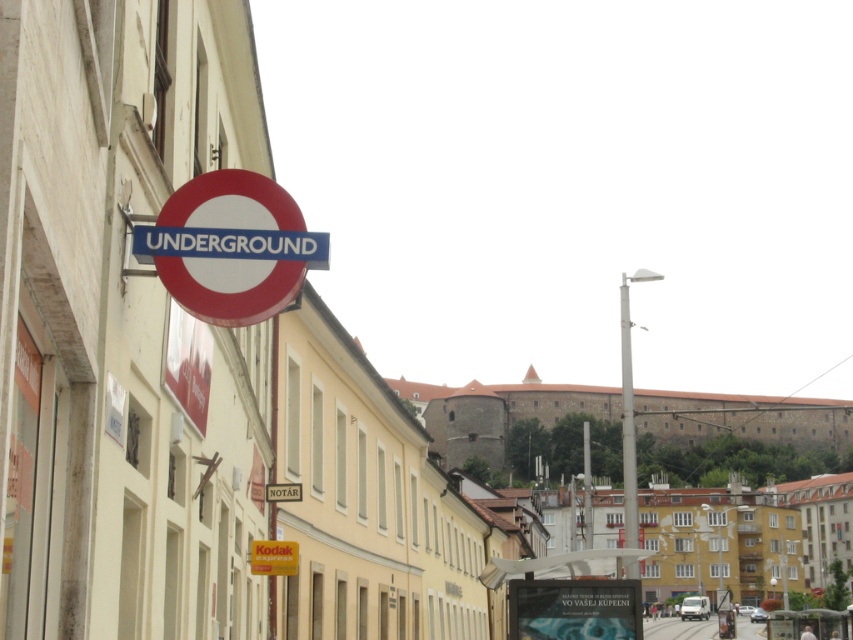
You are standing on the street looking at the beige building. You need to locate the red circular sign at upper left and the white metallic pole at center. Which object is positioned to the left of the other?

The red circular sign at upper left is to the left of the white metallic pole at center.

You are a tourist in this European city and want to find the subway entrance. You see the red circular sign at upper left and the white metallic pole at center. Which object is positioned higher up in the scene?

The red circular sign at upper left is located above the white metallic pole at center, so it is positioned higher up in the scene.